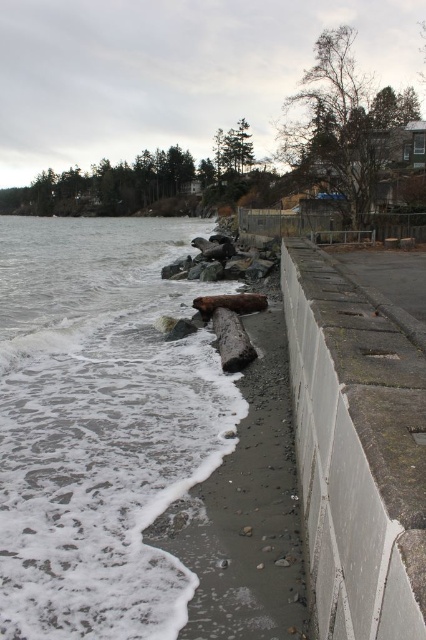
Is point (42, 332) behind point (394, 461)?

That is True.

Identify the location of gray/foamy water at lower left. This screenshot has height=640, width=426. (100, 424).